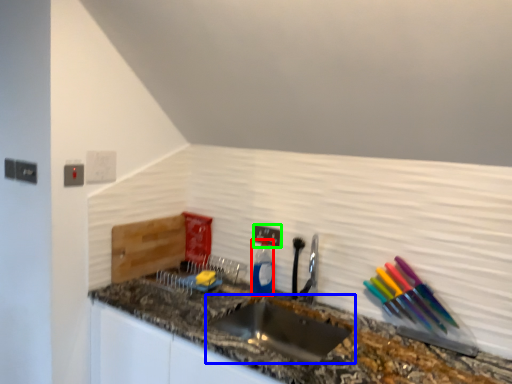
Question: Which is nearer to the bottle (highlighted by a red box)? sink (highlighted by a blue box) or electric outlet (highlighted by a green box).

Choices:
 (A) sink
 (B) electric outlet

Answer: (B)